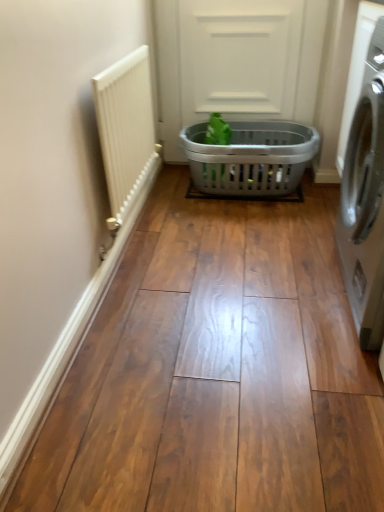
Question: Is white textured radiator at left located outside gray plastic laundry basket at center?

Choices:
 (A) no
 (B) yes

Answer: (B)

Question: From a real-world perspective, is white textured radiator at left beneath gray plastic laundry basket at center?

Choices:
 (A) no
 (B) yes

Answer: (A)

Question: Could you tell me if white textured radiator at left is turned towards gray plastic laundry basket at center?

Choices:
 (A) yes
 (B) no

Answer: (A)

Question: From a real-world perspective, is white textured radiator at left over gray plastic laundry basket at center?

Choices:
 (A) yes
 (B) no

Answer: (A)

Question: Considering the relative sizes of white textured radiator at left and gray plastic laundry basket at center in the image provided, is white textured radiator at left bigger than gray plastic laundry basket at center?

Choices:
 (A) yes
 (B) no

Answer: (B)

Question: Is satin silver washing machine at right wider or thinner than gray plastic laundry basket at center?

Choices:
 (A) wide
 (B) thin

Answer: (A)

Question: Is satin silver washing machine at right situated inside gray plastic laundry basket at center or outside?

Choices:
 (A) outside
 (B) inside

Answer: (A)

Question: Is satin silver washing machine at right bigger or smaller than gray plastic laundry basket at center?

Choices:
 (A) small
 (B) big

Answer: (B)

Question: Is point (382, 49) closer or farther from the camera than point (296, 32)?

Choices:
 (A) farther
 (B) closer

Answer: (B)

Question: From their relative heights in the image, would you say gray plastic laundry basket at center is taller or shorter than white textured radiator at left?

Choices:
 (A) short
 (B) tall

Answer: (A)

Question: Is point pyautogui.click(x=249, y=122) positioned closer to the camera than point pyautogui.click(x=107, y=101)?

Choices:
 (A) closer
 (B) farther

Answer: (B)

Question: Is gray plastic laundry basket at center wider or thinner than white textured radiator at left?

Choices:
 (A) wide
 (B) thin

Answer: (A)

Question: Is gray plastic laundry basket at center in front of or behind white textured radiator at left in the image?

Choices:
 (A) behind
 (B) front

Answer: (A)

Question: In terms of height, does satin silver washing machine at right look taller or shorter compared to green matte plant at center?

Choices:
 (A) short
 (B) tall

Answer: (B)

Question: Would you say satin silver washing machine at right is inside or outside green matte plant at center?

Choices:
 (A) inside
 (B) outside

Answer: (B)